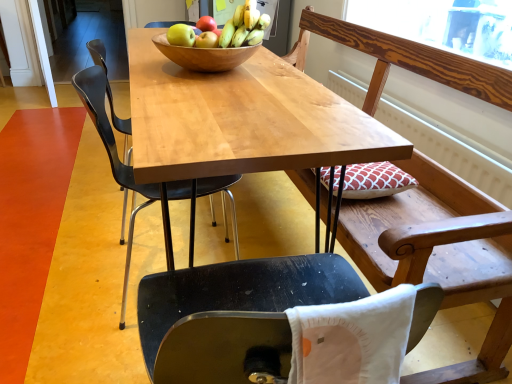
Where is `vacant space that is to the left of wooden table at center`? vacant space that is to the left of wooden table at center is located at coordinates (71, 224).